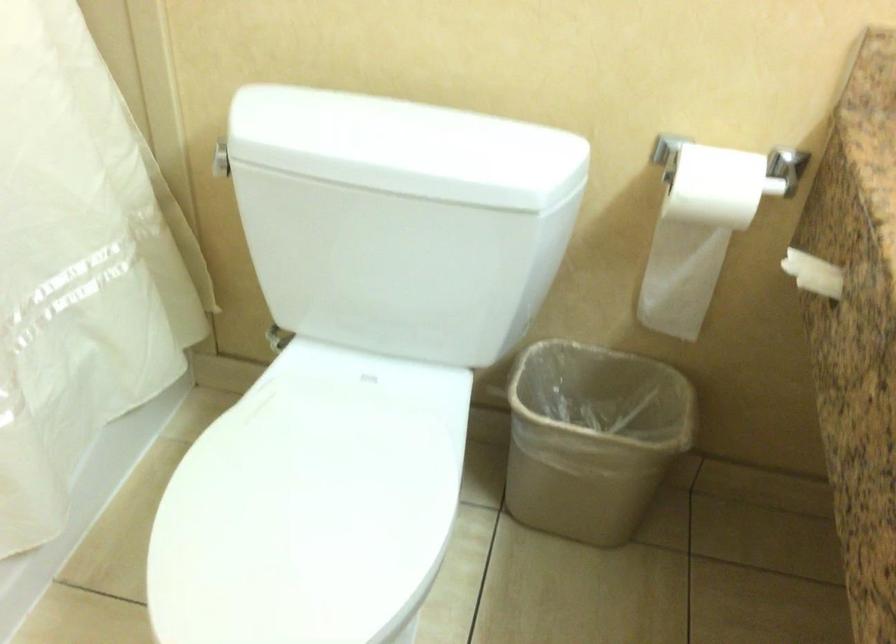
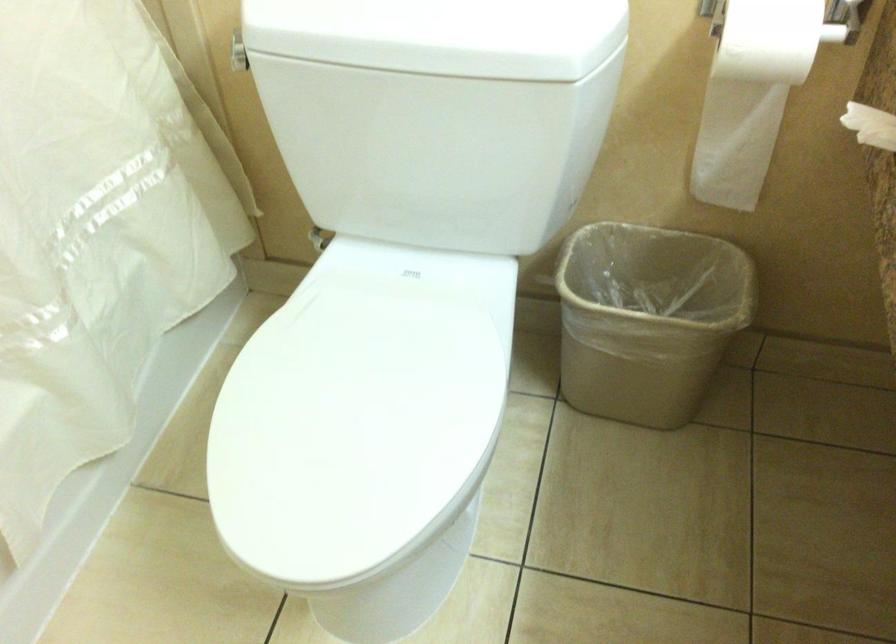
In the second image, find the point that corresponds to (596,438) in the first image.

(647, 319)